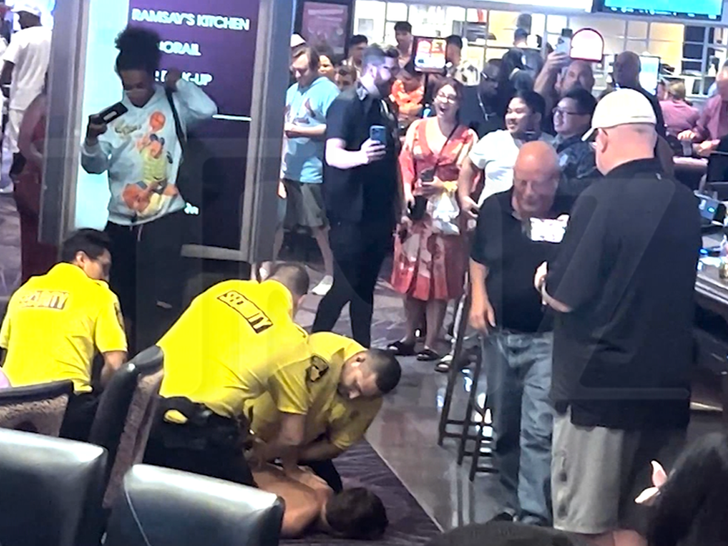
The height and width of the screenshot is (546, 728). Identify the location of phones. (544, 227), (378, 136), (114, 115), (561, 39), (566, 33).